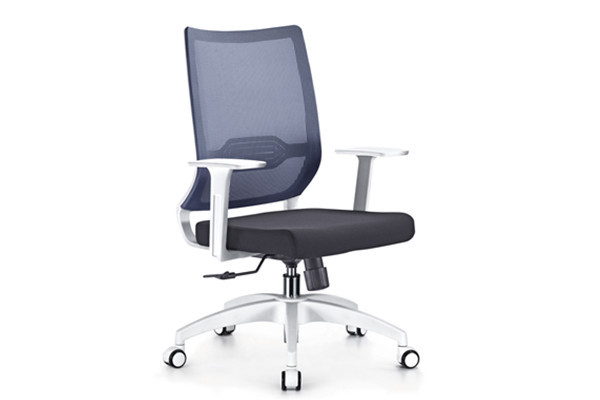
Identify the location of lever to raise and lower seat. (222, 275).